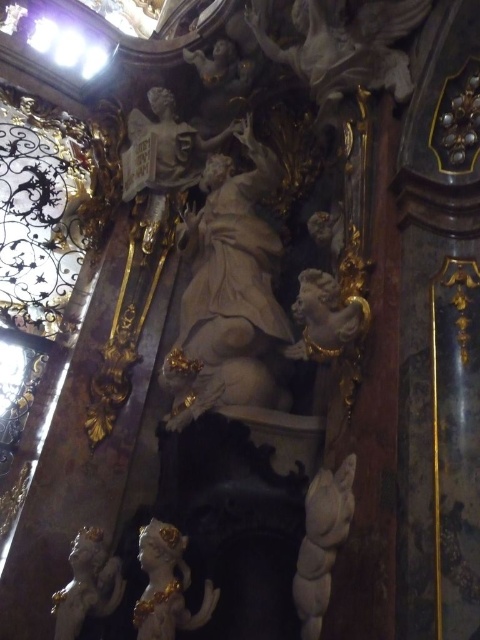
Does white marble statue at center have a greater width compared to white marble cherub at center?

Yes, white marble statue at center is wider than white marble cherub at center.

Is point (222, 248) positioned in front of point (345, 461)?

No, it is behind (345, 461).

Is point (229, 365) closer to camera compared to point (326, 573)?

That is False.

The height and width of the screenshot is (640, 480). I want to click on white marble statue at center, so click(228, 292).

Is white marble cherub at center taller than white marble cherub at lower left?

Correct, white marble cherub at center is much taller as white marble cherub at lower left.

Identify the location of white marble cherub at center. The height and width of the screenshot is (640, 480). (322, 541).

Does point (321, 614) come behind point (72, 600)?

No, it is in front of (72, 600).

The width and height of the screenshot is (480, 640). I want to click on white marble cherub at center, so click(x=322, y=541).

Is point (228, 362) positioned behind point (163, 608)?

Yes, point (228, 362) is farther from viewer.

Locate an element on the screen. The width and height of the screenshot is (480, 640). white marble statue at center is located at coordinates (228, 292).